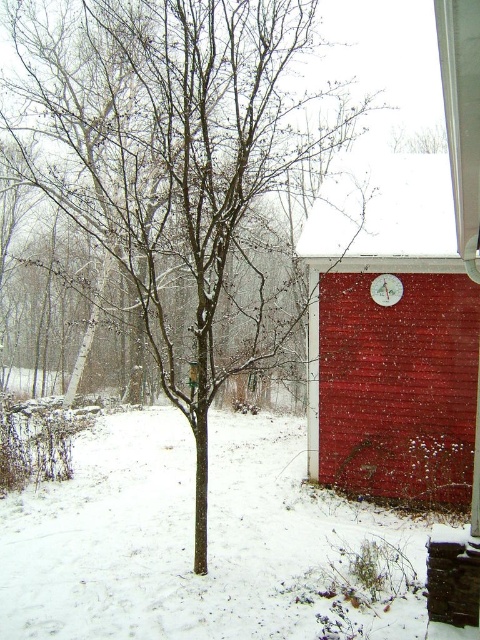
You are a photographer standing in the snowy scene and want to take a photo that includes both the point at (191,300) and the point at (430,472). Which point will appear closer to the front of the photo?

Point at (191,300) will appear closer to the front of the photo because it is further to the camera than point at (430,472).

You are standing in the snowy outdoor scene and notice a point marked at coordinates (x=175, y=161). Based on the description, where is this point located?

The point at coordinates (x=175, y=161) is located on the bare branches of the small tree at the center of the scene.